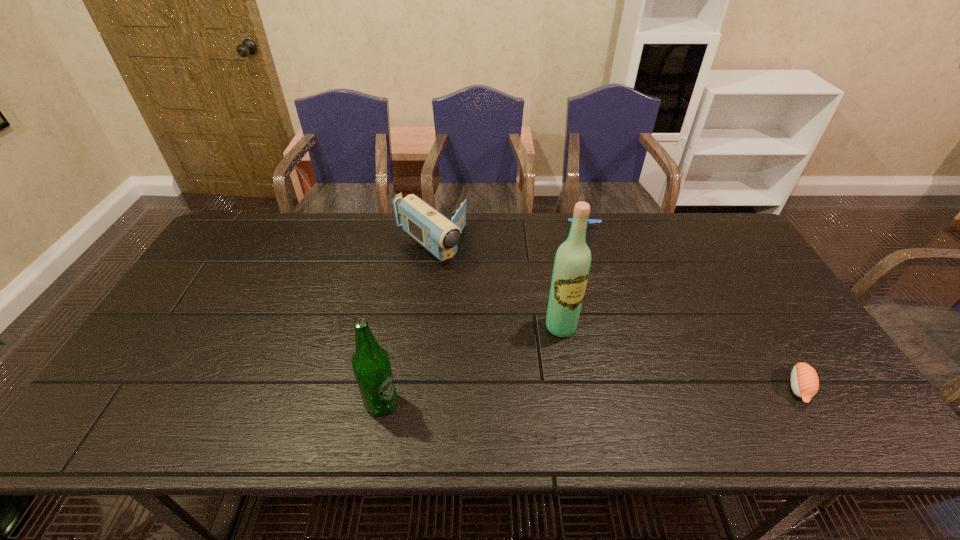
This screenshot has height=540, width=960. What are the coordinates of `vacant space on the desktop that is between the beer bottle and the shortest object and is positioned on the front-facing side of the tallest object` in the screenshot? It's located at (604, 395).

This screenshot has width=960, height=540. Identify the location of free space on the desktop that is between the second tallest object and the shortest object and is positioned on the side of the third tallest object with the flip-out screen. (612, 395).

Where is `vacant spot on the desktop that is between the fourth shortest object and the rightmost object and is positioned on the front-facing side of the second shortest object`? The width and height of the screenshot is (960, 540). vacant spot on the desktop that is between the fourth shortest object and the rightmost object and is positioned on the front-facing side of the second shortest object is located at coordinates (612, 395).